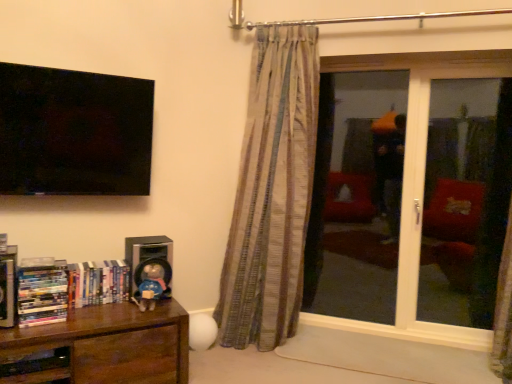
Locate an element on the screen. vacant space in front of striped fabric curtain at center is located at coordinates (263, 361).